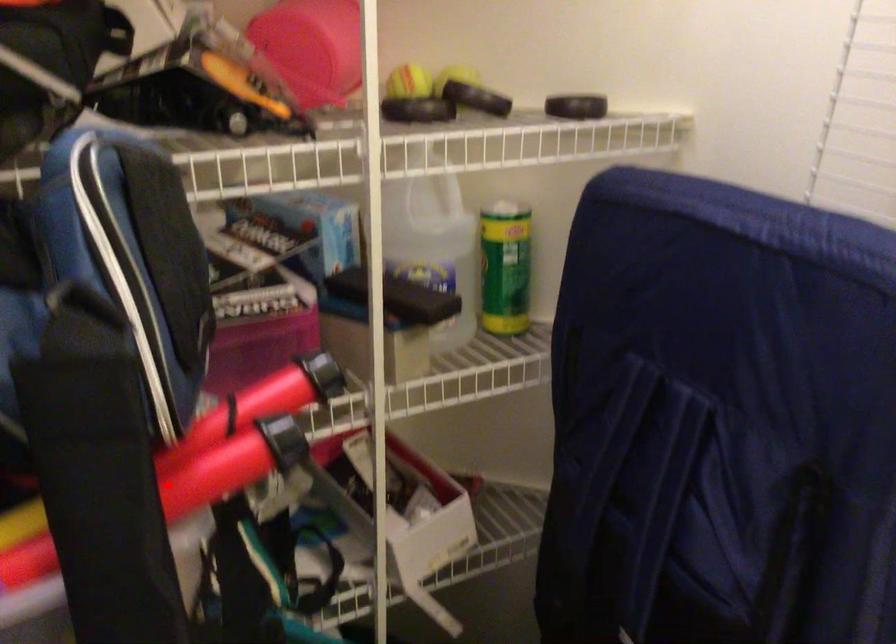
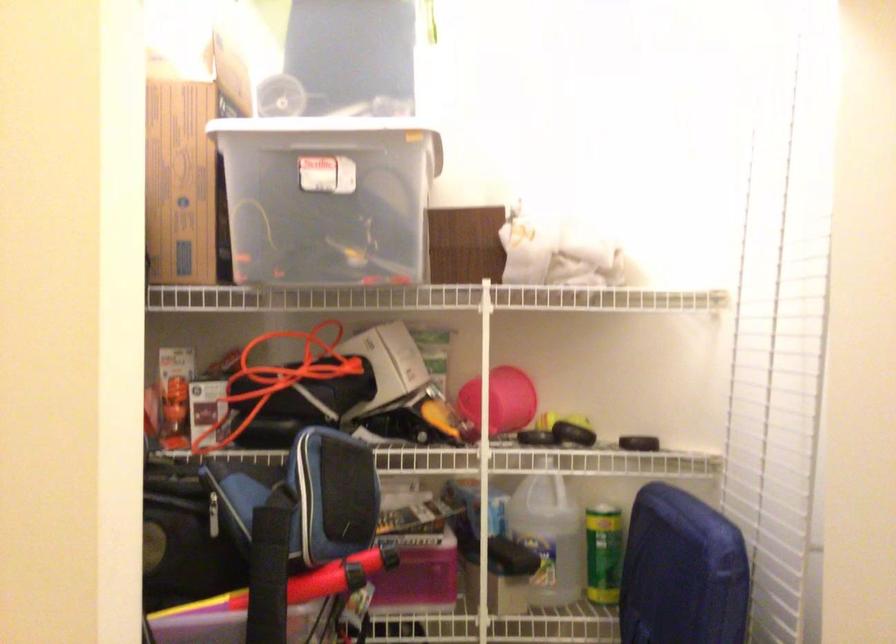
Question: A red point is marked in image1. In image2, is the corresponding 3D point closer to the camera or farther? Reply with the corresponding letter.

Choices:
 (A) The corresponding 3D point is closer.
 (B) The corresponding 3D point is farther.

Answer: (B)